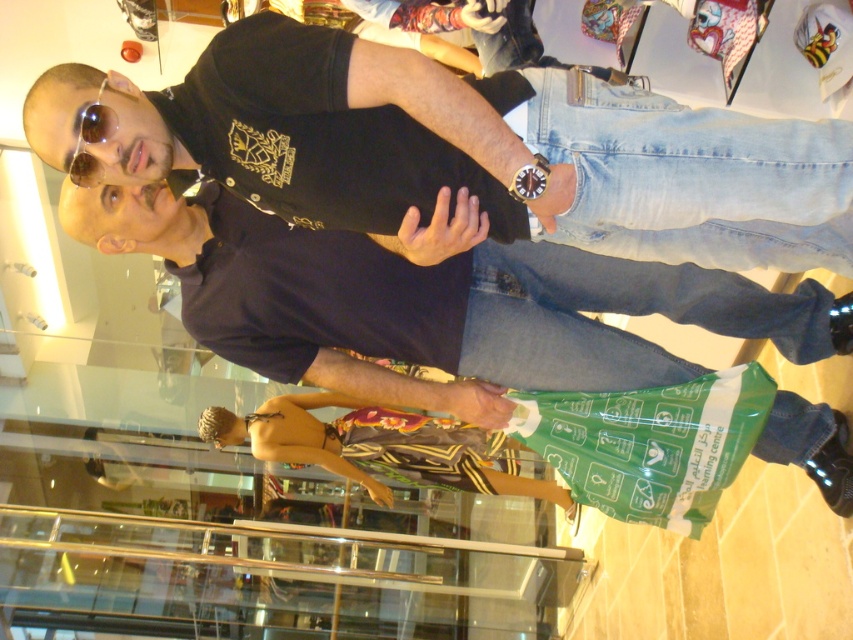
Question: Does black matte shirt at upper center come behind matte black shirt at center?

Choices:
 (A) no
 (B) yes

Answer: (A)

Question: Does black matte shirt at upper center have a larger size compared to matte black shirt at center?

Choices:
 (A) yes
 (B) no

Answer: (B)

Question: Does black matte shirt at upper center come in front of matte black shirt at center?

Choices:
 (A) no
 (B) yes

Answer: (B)